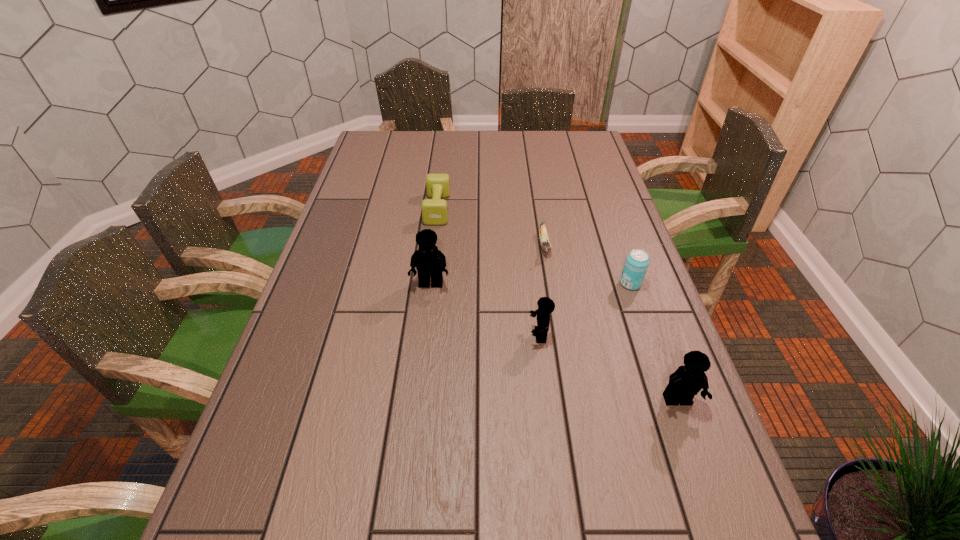
Locate an element on the screen. The image size is (960, 540). empty location between the dumbbell and the second nearest Lego is located at coordinates (489, 272).

Identify the location of free space that is in between the nearest Lego and the farthest Lego. The height and width of the screenshot is (540, 960). (554, 342).

I want to click on empty space that is in between the nearest object and the farthest Lego, so click(x=554, y=342).

Select which object appears as the fourth closest to the leftmost Lego. Please provide its 2D coordinates. Your answer should be formatted as a tuple, i.e. [(x, y)], where the tuple contains the x and y coordinates of a point satisfying the conditions above.

[(636, 264)]

Locate which object is the fifth closest to the fifth farthest object. Please provide its 2D coordinates. Your answer should be formatted as a tuple, i.e. [(x, y)], where the tuple contains the x and y coordinates of a point satisfying the conditions above.

[(434, 211)]

Locate which Lego ranks in proximity to the farthest Lego. Please provide its 2D coordinates. Your answer should be formatted as a tuple, i.e. [(x, y)], where the tuple contains the x and y coordinates of a point satisfying the conditions above.

[(546, 306)]

You are a GUI agent. You are given a task and a screenshot of the screen. Output one action in this format:
    pyautogui.click(x=<x>, y=<y>)
    Task: Click on the Lego that can be found as the second closest to the leftmost Lego
    The width and height of the screenshot is (960, 540).
    Given the screenshot: What is the action you would take?
    pyautogui.click(x=687, y=381)

This screenshot has width=960, height=540. What are the coordinates of `vacant space that satisfies the following two spatial constraints: 1. on the peel of the third object from right to left; 2. on the front-facing side of the shortest Lego` in the screenshot? It's located at (559, 335).